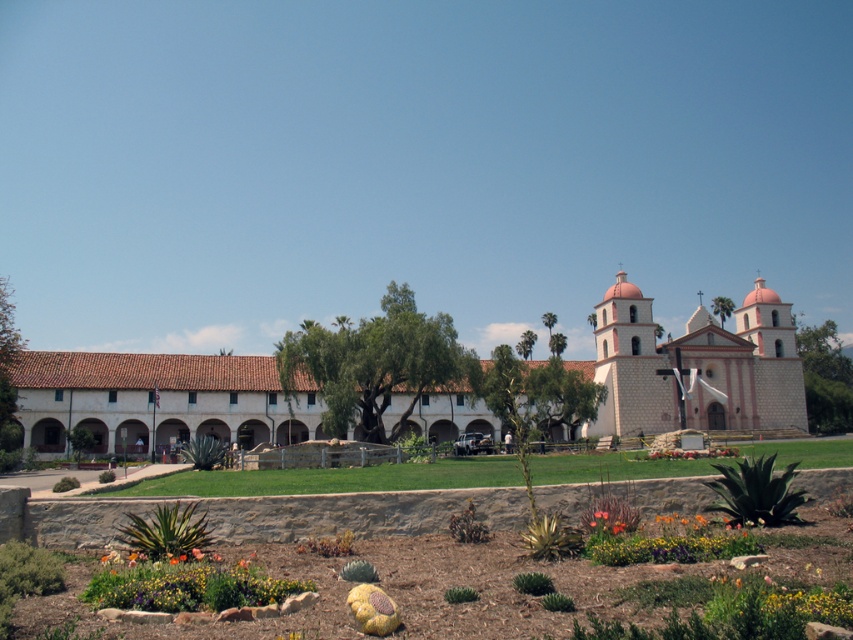
Can you confirm if multicolored mulch bed at lower center is thinner than multicolored fabric flower at lower center?

In fact, multicolored mulch bed at lower center might be wider than multicolored fabric flower at lower center.

Does multicolored mulch bed at lower center appear on the right side of multicolored fabric flower at lower center?

Indeed, multicolored mulch bed at lower center is positioned on the right side of multicolored fabric flower at lower center.

Describe the element at coordinates (479, 580) in the screenshot. I see `multicolored mulch bed at lower center` at that location.

Find the location of `multicolored mulch bed at lower center`. multicolored mulch bed at lower center is located at coordinates (x=479, y=580).

Can you confirm if white stucco building at center is positioned to the left of white stucco chapel at center-right?

Indeed, white stucco building at center is positioned on the left side of white stucco chapel at center-right.

In the scene shown: Is white stucco building at center in front of white stucco chapel at center-right?

Yes, it is in front of white stucco chapel at center-right.

The width and height of the screenshot is (853, 640). I want to click on white stucco building at center, so click(x=694, y=369).

In order to click on white stucco building at center in this screenshot , I will do `click(694, 369)`.

Who is taller, white stucco building at center or multicolored fabric flower at lower center?

With more height is white stucco building at center.

Locate an element on the screen. This screenshot has height=640, width=853. white stucco building at center is located at coordinates (694, 369).